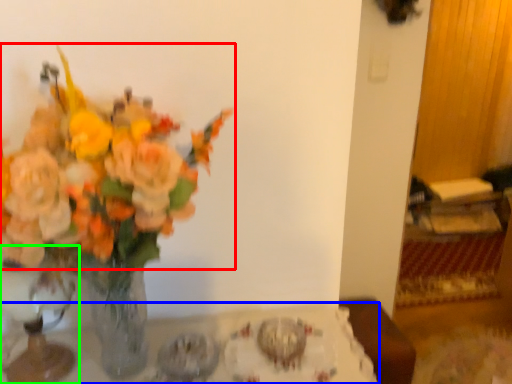
Question: Estimate the real-world distances between objects in this image. Which object is farther from flower (highlighted by a red box), table (highlighted by a blue box) or vase (highlighted by a green box)?

Choices:
 (A) table
 (B) vase

Answer: (A)